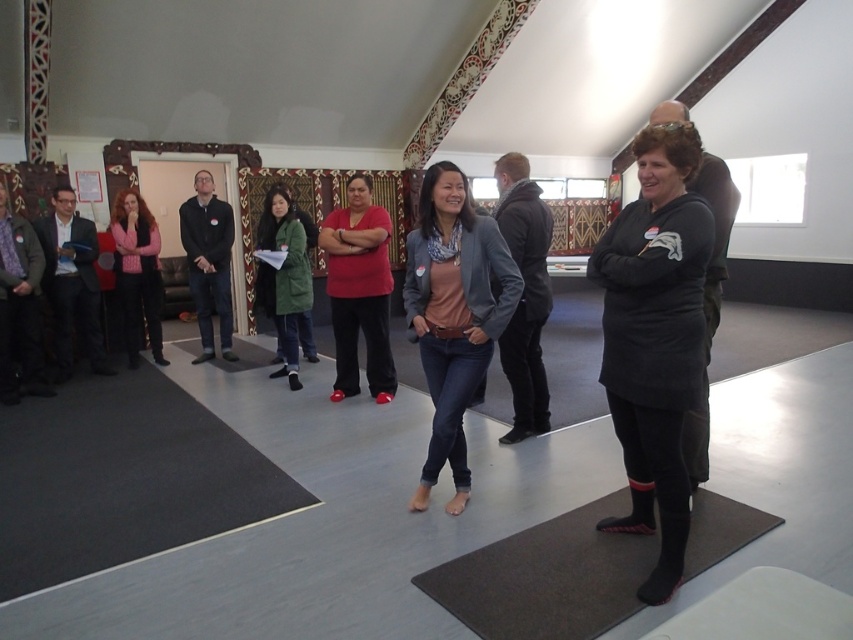
Question: Which object appears closest to the camera in this image?

Choices:
 (A) pink fleece sweater at left
 (B) black rubber yoga mat at lower center

Answer: (B)

Question: Which of the following is the closest to the observer?

Choices:
 (A) (268, 234)
 (B) (357, 260)

Answer: (B)

Question: Can you confirm if black rubber yoga mat at lower center is wider than matte gray blazer at center?

Choices:
 (A) yes
 (B) no

Answer: (A)

Question: Can you confirm if dark gray hoodie at center is positioned to the right of dark gray sweater at left?

Choices:
 (A) yes
 (B) no

Answer: (A)

Question: Which point is farther to the camera?

Choices:
 (A) dark gray hoodie at center
 (B) matte red shirt at center
 (C) black fleece jacket at center

Answer: (B)

Question: Does matte red shirt at center have a greater width compared to dark blue jeans at center?

Choices:
 (A) yes
 (B) no

Answer: (A)